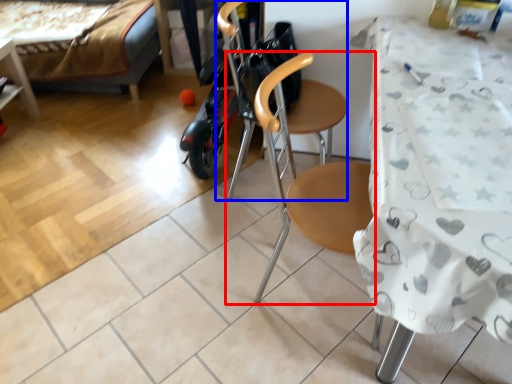
Question: Which point is further to the camera, chair (highlighted by a red box) or swivel chair (highlighted by a blue box)?

Choices:
 (A) chair
 (B) swivel chair

Answer: (B)